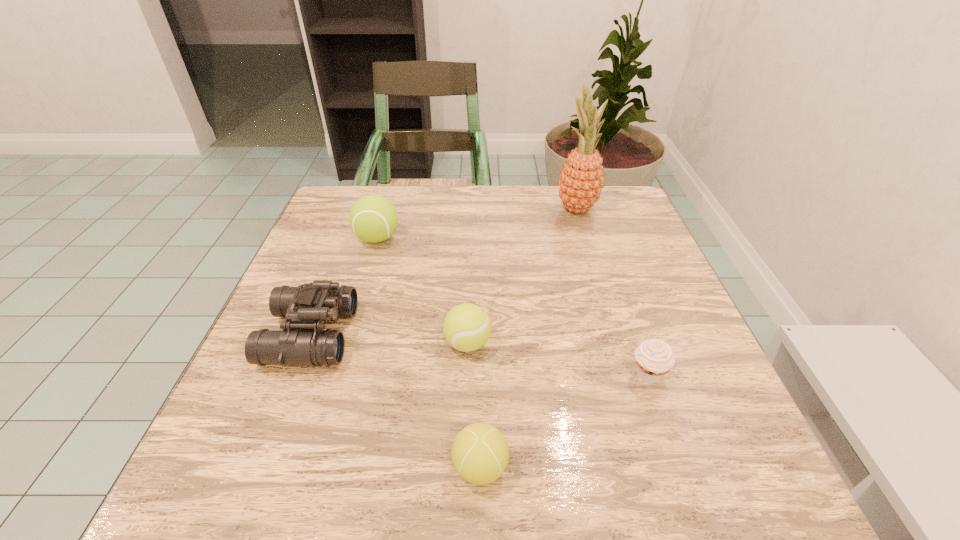
The width and height of the screenshot is (960, 540). Identify the location of vacant space that is in between the second farthest tennis ball and the binoculars. (389, 340).

Identify the location of vacant area between the muffin and the pineapple. (612, 292).

Where is `vacant space in between the muffin and the second farthest tennis ball`? The height and width of the screenshot is (540, 960). vacant space in between the muffin and the second farthest tennis ball is located at coordinates (558, 359).

Locate an element on the screen. The height and width of the screenshot is (540, 960). free space between the tallest object and the second farthest tennis ball is located at coordinates (522, 276).

Where is `vacant space that is in between the binoculars and the second nearest tennis ball`? Image resolution: width=960 pixels, height=540 pixels. vacant space that is in between the binoculars and the second nearest tennis ball is located at coordinates (389, 340).

The image size is (960, 540). I want to click on free space between the binoculars and the second farthest tennis ball, so click(389, 340).

This screenshot has width=960, height=540. In order to click on free area in between the pineapple and the second nearest tennis ball in this screenshot , I will do `click(522, 276)`.

The width and height of the screenshot is (960, 540). I want to click on empty space between the muffin and the second farthest tennis ball, so click(558, 359).

I want to click on unoccupied area between the nearest object and the binoculars, so click(x=396, y=401).

You are a GUI agent. You are given a task and a screenshot of the screen. Output one action in this format:
    pyautogui.click(x=<x>, y=<y>)
    Task: Click on the object that is the third closest one to the farthest object
    This screenshot has width=960, height=540.
    Given the screenshot: What is the action you would take?
    pyautogui.click(x=654, y=357)